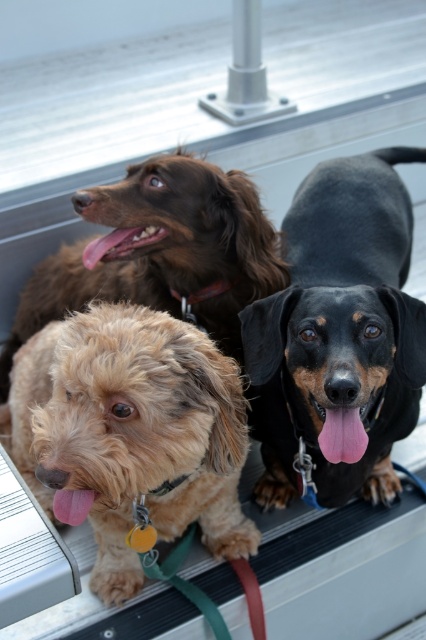
Which is behind, point (160, 195) or point (86, 244)?

Positioned behind is point (86, 244).

Between brown fuzzy dog at upper left and pink glossy tongue at center, which one appears on the right side from the viewer's perspective?

Positioned to the right is pink glossy tongue at center.

Between point (157, 225) and point (138, 230), which one is positioned behind?

The point (138, 230) is behind.

Image resolution: width=426 pixels, height=640 pixels. I want to click on brown fuzzy dog at upper left, so click(x=161, y=252).

Between light brown fur at center and black smooth dachshund at center, which one has less height?

black smooth dachshund at center

Is light brown fur at center above black smooth dachshund at center?

No, light brown fur at center is not above black smooth dachshund at center.

Identify the location of light brown fur at center. (129, 433).

Can you confirm if black smooth dachshund at center is taller than pink glossy tongue at center?

Yes, black smooth dachshund at center is taller than pink glossy tongue at center.

Is point (313, 378) behind point (140, 227)?

No.

I want to click on black smooth dachshund at center, so click(x=339, y=333).